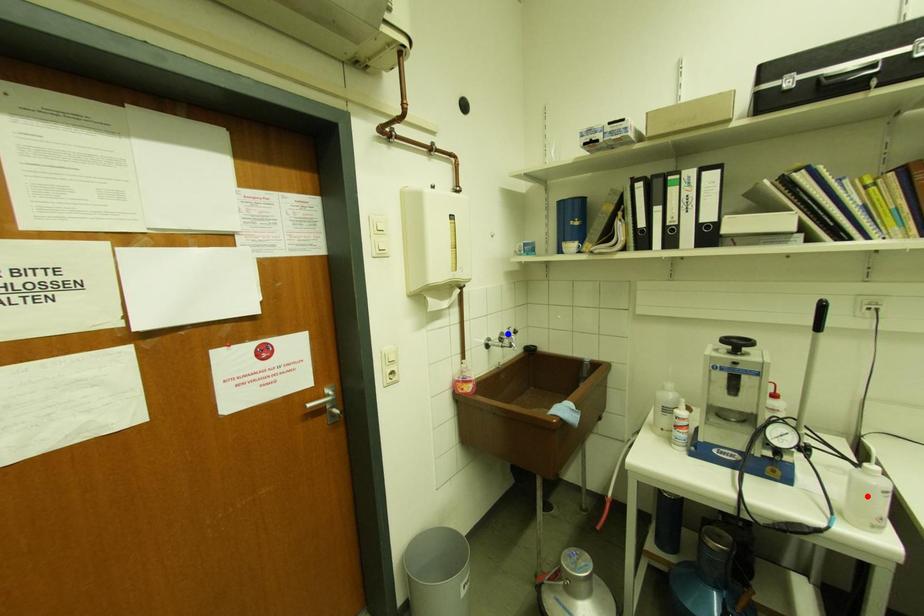
Question: In the image, two points are highlighted. Which point is nearer to the camera? Reply with the corresponding letter.

Choices:
 (A) blue point
 (B) red point

Answer: (B)